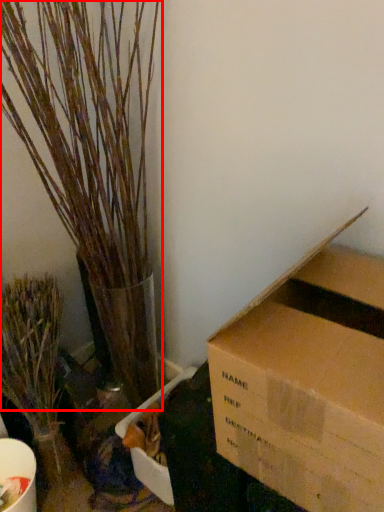
Question: From the image's perspective, what is the correct spatial relationship of houseplant (annotated by the red box) in relation to houseplant?

Choices:
 (A) below
 (B) above

Answer: (B)